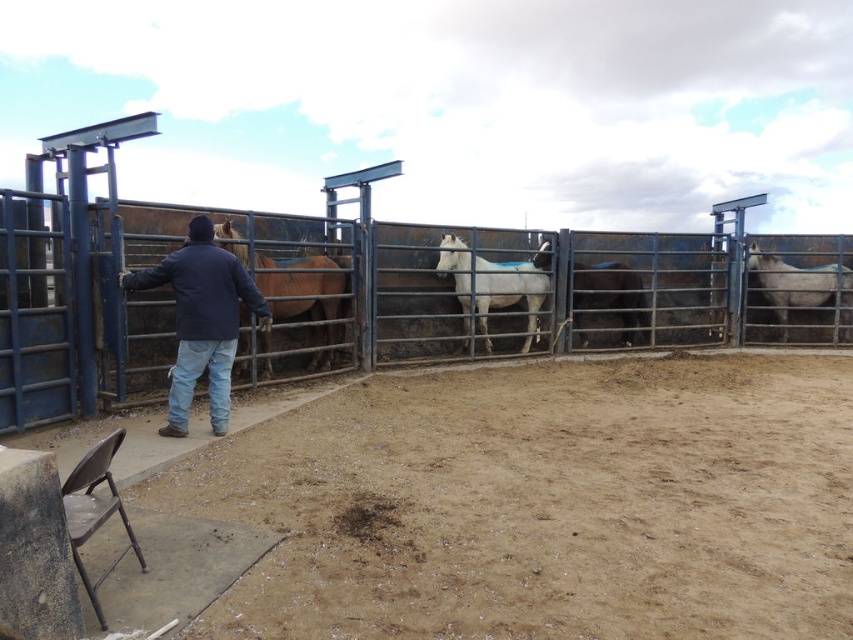
Question: Is rusty metal fence at center to the right of white matte horse at center from the viewer's perspective?

Choices:
 (A) yes
 (B) no

Answer: (B)

Question: Which point appears closest to the camera in this image?

Choices:
 (A) (476, 264)
 (B) (33, 396)
 (C) (292, 262)

Answer: (B)

Question: Considering the relative positions of rusty metal fence at center and brown matte horse at center in the image provided, where is rusty metal fence at center located with respect to brown matte horse at center?

Choices:
 (A) below
 (B) above

Answer: (B)

Question: Which point is closer to the camera?

Choices:
 (A) white glossy horse at center
 (B) dark blue jacket at center
 (C) white matte horse at center
 (D) white glossy horse at right

Answer: (B)

Question: Estimate the real-world distances between objects in this image. Which object is closer to the brown matte horse at center?

Choices:
 (A) white matte horse at center
 (B) rusty metal fence at center

Answer: (B)

Question: Considering the relative positions of rusty metal fence at center and white glossy horse at center in the image provided, where is rusty metal fence at center located with respect to white glossy horse at center?

Choices:
 (A) right
 (B) left

Answer: (A)